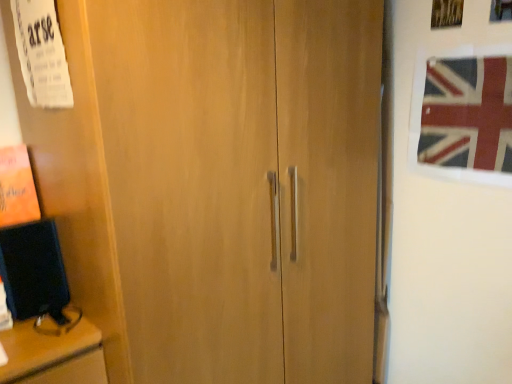
Describe the element at coordinates (41, 54) in the screenshot. The height and width of the screenshot is (384, 512). I see `white paper at upper left` at that location.

At what (x,y) coordinates should I click in order to perform the action: click on white paper at upper left. Please return your answer as a coordinate pair (x, y). Looking at the image, I should click on (41, 54).

In the scene shown: In order to face union jack fabric at upper right, should I rotate leftwards or rightwards?

You should look right and rotate roughly 28.707 degrees.

What do you see at coordinates (467, 114) in the screenshot?
I see `union jack fabric at upper right` at bounding box center [467, 114].

At what (x,y) coordinates should I click in order to perform the action: click on union jack fabric at upper right. Please return your answer as a coordinate pair (x, y). Image resolution: width=512 pixels, height=384 pixels. Looking at the image, I should click on (467, 114).

At what (x,y) coordinates should I click in order to perform the action: click on white paper at upper left. Please return your answer as a coordinate pair (x, y). Looking at the image, I should click on (41, 54).

Does union jack fabric at upper right appear on the left side of white paper at upper left?

Incorrect, union jack fabric at upper right is not on the left side of white paper at upper left.

Between union jack fabric at upper right and white paper at upper left, which one is positioned behind?

union jack fabric at upper right is further from the camera.

Which is closer to the camera, (x=463, y=95) or (x=62, y=51)?

Point (x=463, y=95) is positioned farther from the camera compared to point (x=62, y=51).

From the image's perspective, which one is positioned lower, union jack fabric at upper right or white paper at upper left?

union jack fabric at upper right appears lower in the image.

From a real-world perspective, who is located lower, union jack fabric at upper right or white paper at upper left?

union jack fabric at upper right, from a real-world perspective.

Looking at this image, looking at their sizes, would you say union jack fabric at upper right is wider or thinner than white paper at upper left?

union jack fabric at upper right is thinner than white paper at upper left.

Considering the relative sizes of union jack fabric at upper right and white paper at upper left in the image provided, is union jack fabric at upper right shorter than white paper at upper left?

Indeed, union jack fabric at upper right has a lesser height compared to white paper at upper left.

Does union jack fabric at upper right have a smaller size compared to white paper at upper left?

Correct, union jack fabric at upper right occupies less space than white paper at upper left.

Is union jack fabric at upper right spatially inside white paper at upper left, or outside of it?

union jack fabric at upper right is spatially situated outside white paper at upper left.

Is union jack fabric at upper right next to white paper at upper left and touching it?

No, union jack fabric at upper right is not touching white paper at upper left.

Does union jack fabric at upper right turn towards white paper at upper left?

Yes, union jack fabric at upper right is oriented towards white paper at upper left.

How many degrees apart are the facing directions of union jack fabric at upper right and white paper at upper left?

They differ by 1.98 degrees in their facing directions.

You are a GUI agent. You are given a task and a screenshot of the screen. Output one action in this format:
    pyautogui.click(x=<x>, y=<y>)
    Task: Click on the poster above the union jack fabric at upper right (from a real-world perspective)
    
    Given the screenshot: What is the action you would take?
    pyautogui.click(x=41, y=54)

Is white paper at upper left at the right side of union jack fabric at upper right?

Incorrect, white paper at upper left is not on the right side of union jack fabric at upper right.

From the picture: Is the depth of white paper at upper left greater than that of union jack fabric at upper right?

No, the depth of white paper at upper left is less than that of union jack fabric at upper right.

Is point (68, 78) less distant than point (493, 131)?

Yes, point (68, 78) is closer to viewer.

From the image's perspective, who appears lower, white paper at upper left or union jack fabric at upper right?

union jack fabric at upper right.

From a real-world perspective, who is located lower, white paper at upper left or union jack fabric at upper right?

union jack fabric at upper right is physically lower.

Considering the sizes of objects white paper at upper left and union jack fabric at upper right in the image provided, who is thinner, white paper at upper left or union jack fabric at upper right?

union jack fabric at upper right.

From their relative heights in the image, would you say white paper at upper left is taller or shorter than union jack fabric at upper right?

Considering their sizes, white paper at upper left has more height than union jack fabric at upper right.

Who is smaller, white paper at upper left or union jack fabric at upper right?

union jack fabric at upper right.

Can we say white paper at upper left lies outside union jack fabric at upper right?

white paper at upper left lies outside union jack fabric at upper right's area.

Is white paper at upper left not close to union jack fabric at upper right?

Absolutely, white paper at upper left is distant from union jack fabric at upper right.

Could you tell me if white paper at upper left is facing union jack fabric at upper right?

No, white paper at upper left does not turn towards union jack fabric at upper right.

In the scene shown: What's the angular difference between white paper at upper left and union jack fabric at upper right's facing directions?

There is a 1.98-degree angle between the facing directions of white paper at upper left and union jack fabric at upper right.

In order to click on flag that is below the white paper at upper left (from the image's perspective) in this screenshot , I will do `click(467, 114)`.

Identify the location of flag below the white paper at upper left (from the image's perspective). (467, 114).

The width and height of the screenshot is (512, 384). Find the location of `poster above the union jack fabric at upper right (from the image's perspective)`. poster above the union jack fabric at upper right (from the image's perspective) is located at coordinates (41, 54).